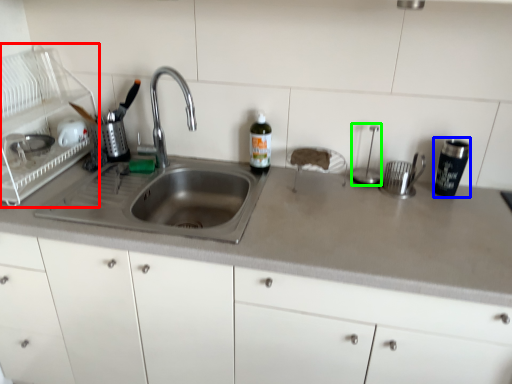
Question: Which object is positioned closest to appliance (highlighted by a red box)? Select from tableware (highlighted by a blue box) and appliance (highlighted by a green box).

Choices:
 (A) tableware
 (B) appliance

Answer: (B)